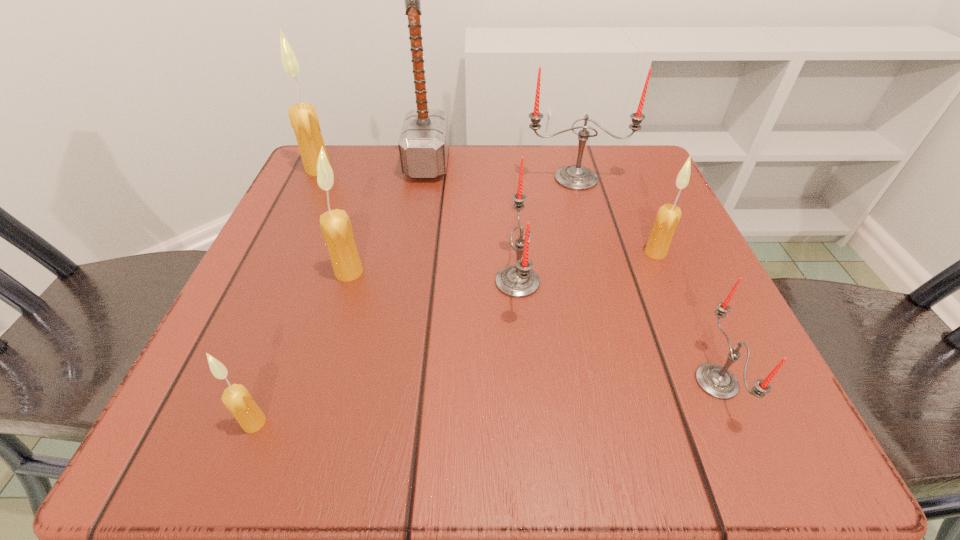
Identify the location of vacant space at the far edge of the desktop. The width and height of the screenshot is (960, 540). (511, 156).

Identify the location of free space at the near edge of the desktop. This screenshot has width=960, height=540. (559, 406).

The height and width of the screenshot is (540, 960). I want to click on vacant space at the left edge of the desktop, so click(307, 345).

Image resolution: width=960 pixels, height=540 pixels. In the image, there is a desktop. Identify the location of vacant area at the right edge. (636, 267).

You are a GUI agent. You are given a task and a screenshot of the screen. Output one action in this format:
    pyautogui.click(x=<x>, y=<y>)
    Task: Click on the vacant space at the far left corner of the desktop
    The width and height of the screenshot is (960, 540).
    Given the screenshot: What is the action you would take?
    pyautogui.click(x=344, y=154)

In the image, there is a desktop. At what (x,y) coordinates should I click in order to perform the action: click on vacant space at the far right corner. Please return your answer as a coordinate pair (x, y). The image size is (960, 540). Looking at the image, I should click on (615, 159).

Where is `vacant space at the near right corner`? The image size is (960, 540). vacant space at the near right corner is located at coordinates (677, 410).

This screenshot has height=540, width=960. I want to click on vacant space that is in between the farthest red candle and the third biggest cream candle, so click(x=615, y=215).

Locate an element on the screen. The height and width of the screenshot is (540, 960). empty location between the second tallest object and the second nearest red candle is located at coordinates (418, 226).

The image size is (960, 540). In order to click on free area in between the seventh object from right to left and the nearest red candle in this screenshot , I will do `click(486, 402)`.